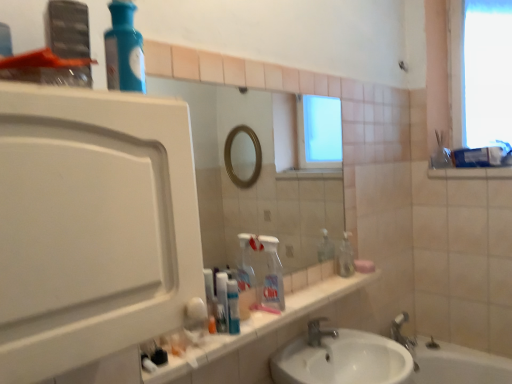
Question: From a real-world perspective, is pink matte soap at right beneath blue glass bottle at upper left, marked as the second cleaning product in a back-to-front arrangement?

Choices:
 (A) no
 (B) yes

Answer: (B)

Question: Is pink matte soap at right positioned in front of blue glass bottle at upper left, marked as the second cleaning product in a back-to-front arrangement?

Choices:
 (A) yes
 (B) no

Answer: (B)

Question: Considering the relative sizes of pink matte soap at right and blue glass bottle at upper left, the 1th cleaning product viewed from the top, in the image provided, is pink matte soap at right shorter than blue glass bottle at upper left, the 1th cleaning product viewed from the top,?

Choices:
 (A) no
 (B) yes

Answer: (B)

Question: Could you tell me if pink matte soap at right is facing blue glass bottle at upper left, the 1th cleaning product viewed from the top?

Choices:
 (A) no
 (B) yes

Answer: (A)

Question: Are pink matte soap at right and blue glass bottle at upper left, the 1th cleaning product viewed from the top, far apart?

Choices:
 (A) no
 (B) yes

Answer: (B)

Question: Does pink matte soap at right touch blue glass bottle at upper left, marked as the second cleaning product in a back-to-front arrangement?

Choices:
 (A) no
 (B) yes

Answer: (A)

Question: Is white plastic toothpaste tube at center next to silver metallic faucet at sink center and touching it?

Choices:
 (A) yes
 (B) no

Answer: (B)

Question: Is white plastic toothpaste tube at center at the right side of silver metallic faucet at sink center?

Choices:
 (A) yes
 (B) no

Answer: (B)

Question: Is white plastic toothpaste tube at center facing towards silver metallic faucet at sink center?

Choices:
 (A) no
 (B) yes

Answer: (A)

Question: Is white plastic toothpaste tube at center looking in the opposite direction of silver metallic faucet at sink center?

Choices:
 (A) no
 (B) yes

Answer: (A)

Question: Can you confirm if white plastic toothpaste tube at center is thinner than silver metallic faucet at sink center?

Choices:
 (A) no
 (B) yes

Answer: (B)

Question: Is white plastic toothpaste tube at center to the left of silver metallic faucet at sink center from the viewer's perspective?

Choices:
 (A) no
 (B) yes

Answer: (B)

Question: Can you confirm if white matte cabinet at left is shorter than white plastic toothpaste tube at center?

Choices:
 (A) yes
 (B) no

Answer: (B)